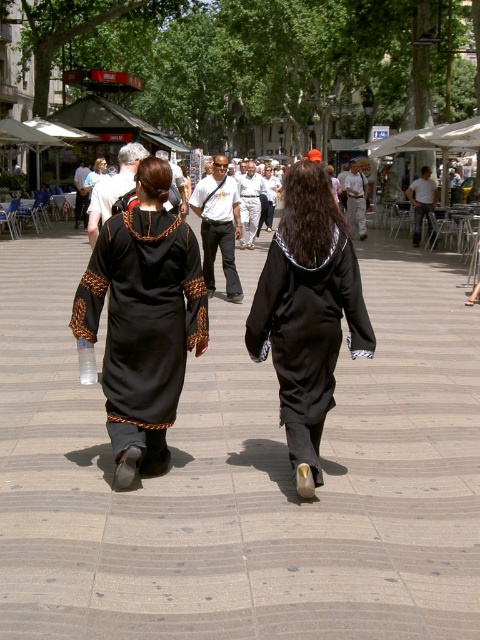
Between point (226, 177) and point (355, 227), which one is positioned behind?

Positioned behind is point (355, 227).

Does white cotton shirt at center appear under black matte robe at center?

Correct, white cotton shirt at center is located below black matte robe at center.

Identify the location of white cotton shirt at center. This screenshot has width=480, height=640. (218, 225).

Which is behind, point (274, 454) or point (244, 228)?

The point (244, 228) is more distant.

From the picture: Who is more forward, (33, 307) or (252, 211)?

Point (33, 307) is in front.

Locate an element on the screen. The width and height of the screenshot is (480, 640). smooth concrete pavement at center is located at coordinates (243, 474).

Is smooth concrete pavement at center thinner than black matte robe at center?

In fact, smooth concrete pavement at center might be wider than black matte robe at center.

Is point (432, 312) positioned before point (364, 224)?

Yes, it is.

Is point (474, 477) less distant than point (350, 209)?

Yes.

At what (x,y) coordinates should I click in order to perform the action: click on smooth concrete pavement at center. Please return your answer as a coordinate pair (x, y). The image size is (480, 640). Looking at the image, I should click on (243, 474).